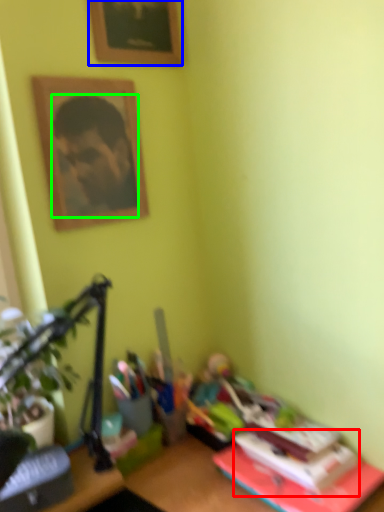
Question: Considering the real-world distances, which object is closest to paperback book (highlighted by a red box)? picture frame (highlighted by a blue box) or man (highlighted by a green box).

Choices:
 (A) picture frame
 (B) man

Answer: (B)